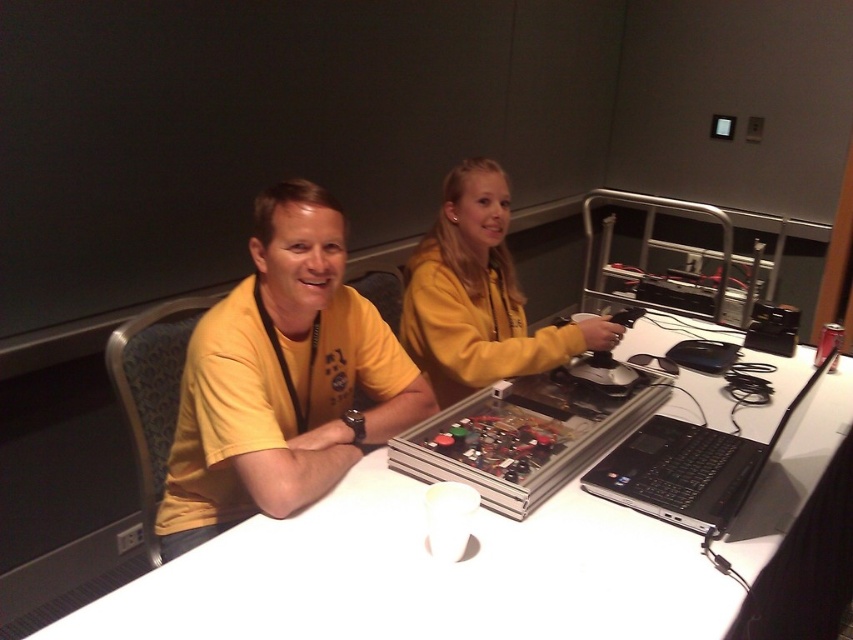
You are a delivery person who needs to place a 16 inch box on the table. Can you fit it between the white glossy table at center and the yellow fleece at center?

The white glossy table at center is 18.89 inches from the yellow fleece at center. Since the box is 16 inches long, it can fit between them as the distance is sufficient.

You are a delivery robot that needs to place a package between the yellow fleece at center and the black matte laptop at lower right. The package is 20 inches long. Can you fit it between them without moving either object?

The yellow fleece at center and black matte laptop at lower right are 20.39 inches apart from each other. Since the package is 20 inches long, it can fit between them as there is enough space.

You are a delivery robot with a 6.5 inch wide package. You need to place it between the white glossy table at center and the black matte laptop at lower right. Is there enough space?

The white glossy table at center and black matte laptop at lower right are 6.58 inches apart, so yes, the robot can place the 6.5 inch wide package between them as there is sufficient space.